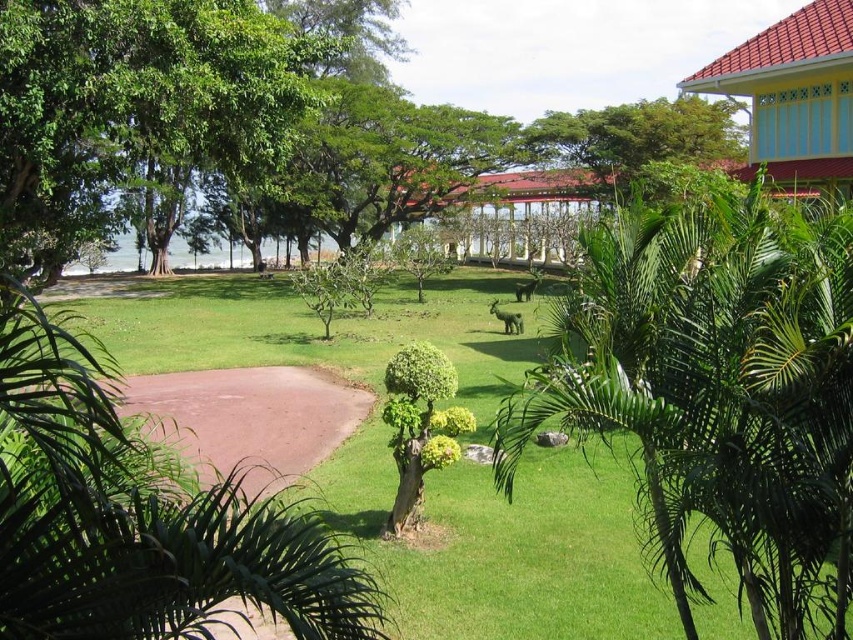
Question: Is green leafy palm tree at center-right wider than yellow painted wood hut at upper right?

Choices:
 (A) no
 (B) yes

Answer: (A)

Question: Does green leafy palm tree at center-right have a lesser width compared to yellow painted wood hut at upper right?

Choices:
 (A) no
 (B) yes

Answer: (B)

Question: Among these objects, which one is farthest from the camera?

Choices:
 (A) green leafy palm tree at center-right
 (B) yellow painted wood hut at upper right

Answer: (B)

Question: Which object is positioned farthest from the yellow painted wood hut at upper right?

Choices:
 (A) green leafy palm tree at lower left
 (B) green leafy palm tree at center-right

Answer: (A)

Question: Can you confirm if green leafy palm tree at lower left is positioned above yellow painted wood hut at upper right?

Choices:
 (A) no
 (B) yes

Answer: (A)

Question: Among these points, which one is farthest from the camera?

Choices:
 (A) (322, 632)
 (B) (811, 163)

Answer: (B)